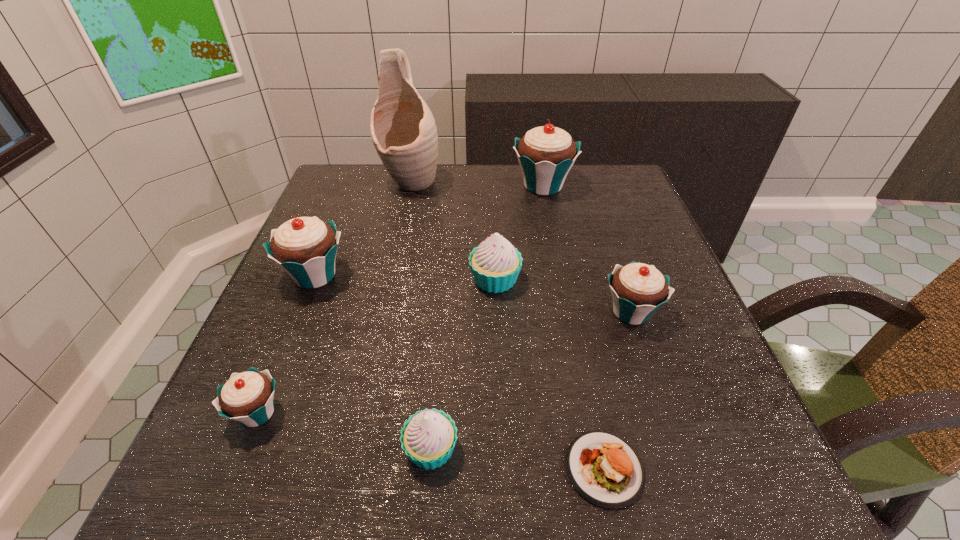
Locate an element on the screen. pitcher is located at coordinates (403, 130).

Locate an element on the screen. This screenshot has height=540, width=960. the tallest cupcake is located at coordinates (546, 154).

At what (x,y) coordinates should I click in order to perform the action: click on the farthest cupcake. Please return your answer as a coordinate pair (x, y). Looking at the image, I should click on (546, 154).

Identify the location of the sixth shortest object. The image size is (960, 540). (305, 248).

Identify the location of the second biggest teal cupcake. This screenshot has height=540, width=960. (305, 248).

Find the location of a particular element. This screenshot has height=540, width=960. the right white cupcake is located at coordinates pyautogui.click(x=495, y=264).

Locate an element on the screen. the bigger white cupcake is located at coordinates (495, 264).

The width and height of the screenshot is (960, 540). Find the location of `the second smallest teal cupcake`. the second smallest teal cupcake is located at coordinates (638, 290).

Image resolution: width=960 pixels, height=540 pixels. Find the location of `the smallest teal cupcake`. the smallest teal cupcake is located at coordinates (247, 397).

Identify the location of the smaller white cupcake. (428, 438).